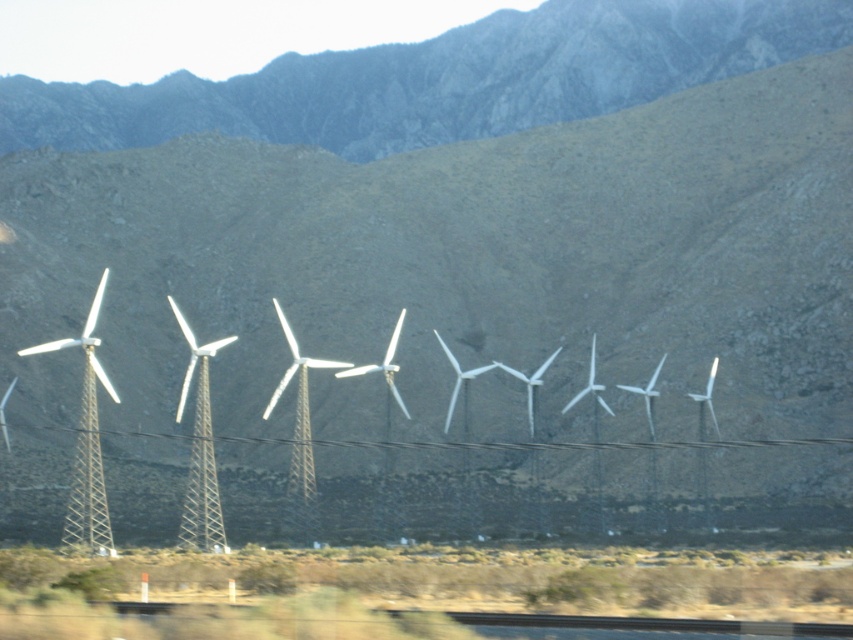
Question: Which point is closer to the camera taking this photo?

Choices:
 (A) click(x=704, y=484)
 (B) click(x=106, y=538)
 (C) click(x=213, y=513)

Answer: (B)

Question: Does white metallic wind turbines at center appear on the right side of metallic silver power line at center?

Choices:
 (A) no
 (B) yes

Answer: (A)

Question: Can you confirm if white metallic windmill at center is wider than metallic silver power line at center?

Choices:
 (A) yes
 (B) no

Answer: (B)

Question: Where is white metallic wind turbines at center located in relation to metallic silver power line at center in the image?

Choices:
 (A) right
 (B) left

Answer: (B)

Question: Which point is closer to the camera taking this photo?

Choices:
 (A) click(500, 445)
 (B) click(83, 477)
 (C) click(219, 528)

Answer: (B)

Question: Which point is farther to the camera?

Choices:
 (A) white metallic windmill at left
 (B) white metallic windmill at center

Answer: (B)